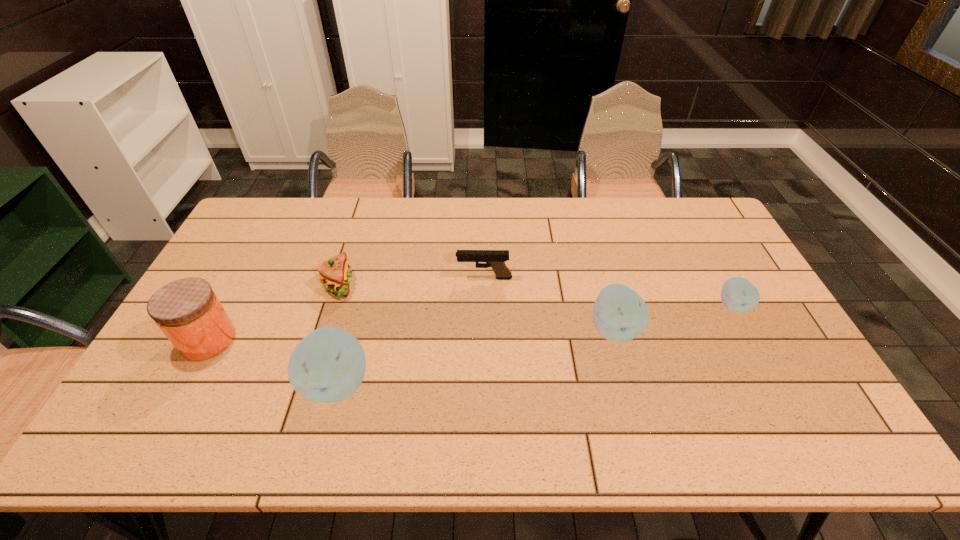
In order to click on blank space located 0.360m on the left of the rightmost object in this screenshot , I will do `click(594, 306)`.

Where is `vacant space positioned on the back of the jar`? The height and width of the screenshot is (540, 960). vacant space positioned on the back of the jar is located at coordinates (263, 239).

Find the location of a particular element. vacant point located 0.090m on the left of the sandwich is located at coordinates (294, 285).

Locate an element on the screen. The width and height of the screenshot is (960, 540). free space located on the front-facing side of the fourth object from left to right is located at coordinates (399, 278).

At what (x,y) coordinates should I click in order to perform the action: click on free region located 0.140m on the front-facing side of the fourth object from left to right. Please return your answer as a coordinate pair (x, y). The height and width of the screenshot is (540, 960). Looking at the image, I should click on tap(412, 278).

You are a GUI agent. You are given a task and a screenshot of the screen. Output one action in this format:
    pyautogui.click(x=<x>, y=<y>)
    Task: Click on the blank space located on the front-facing side of the fourth object from left to right
    The width and height of the screenshot is (960, 540).
    Given the screenshot: What is the action you would take?
    pyautogui.click(x=384, y=278)

Where is `object at the near edge`? This screenshot has height=540, width=960. object at the near edge is located at coordinates (328, 365).

You are a GUI agent. You are given a task and a screenshot of the screen. Output one action in this format:
    pyautogui.click(x=<x>, y=<y>)
    Task: Click on the object at the left edge
    The width and height of the screenshot is (960, 540).
    Given the screenshot: What is the action you would take?
    pyautogui.click(x=188, y=312)

Identify the location of object at the right edge. (738, 295).

At what (x,y) coordinates should I click in order to perform the action: click on vacant point at the far edge. Please return your answer as a coordinate pair (x, y). Looking at the image, I should click on (570, 199).